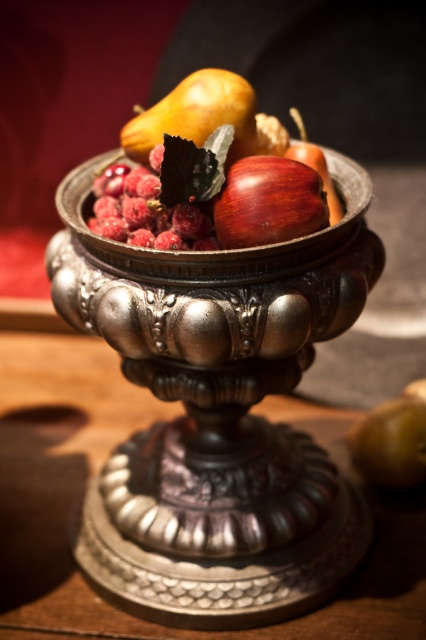
Question: Is metallic silver bowl at center wider than shiny green apple at lower right?

Choices:
 (A) yes
 (B) no

Answer: (A)

Question: Among these objects, which one is nearest to the camera?

Choices:
 (A) shiny red apple at center
 (B) shiny brown apple at center
 (C) metallic silver bowl at center
 (D) shiny green apple at lower right

Answer: (C)

Question: Among these objects, which one is nearest to the camera?

Choices:
 (A) shiny brown apple at center
 (B) shiny green apple at lower right
 (C) metallic silver bowl at center
 (D) shiny brown pear at center

Answer: (C)

Question: Which point is farther to the camera?

Choices:
 (A) (331, 216)
 (B) (160, 116)
 (C) (192, 368)
 (D) (258, 227)

Answer: (A)

Question: Is shiny brown apple at center below shiny green apple at lower right?

Choices:
 (A) yes
 (B) no

Answer: (B)

Question: Does shiny brown apple at center have a greater width compared to shiny green apple at lower right?

Choices:
 (A) yes
 (B) no

Answer: (A)